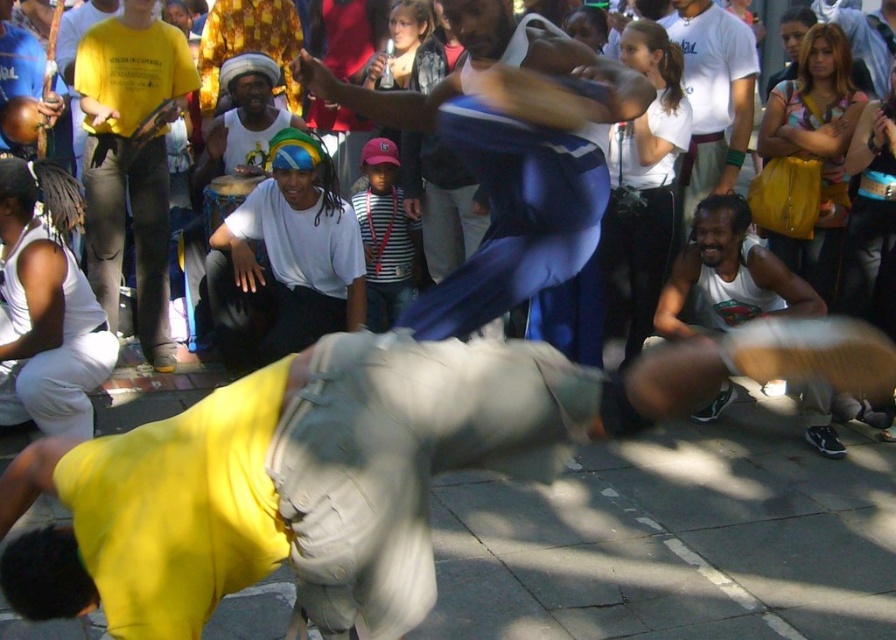
You are a photographer standing at the origin point of the image coordinate system. You want to capture a closeup shot of the blue fabric pants at center. What are the coordinates where you should aim your camera?

The coordinates to aim your camera are at point (515, 170) to capture the blue fabric pants at center.